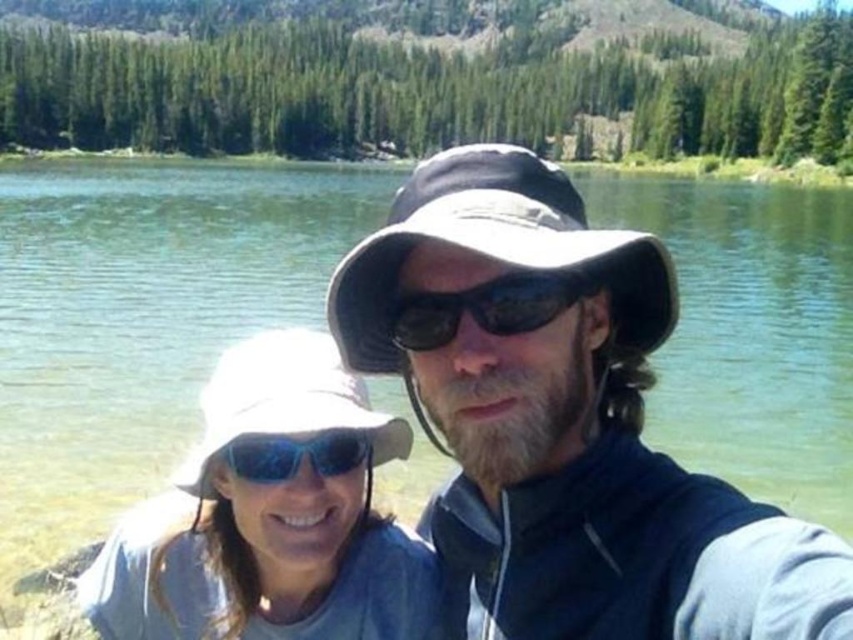
Based on the scene described, where exactly is the white matte hat at center located in terms of coordinates?

The white matte hat at center is located at coordinates point (270, 515).

You are a photographer trying to capture a clear shot of the white matte hat at center and the blue reflective lens goggles at center. Since both are at the center, which one is more likely to be in focus if you focus on the center of the image?

The white matte hat at center is much taller as blue reflective lens goggles at center, so focusing on the center would likely put the white matte hat at center in focus first since it is taller and occupies more space in the frame.